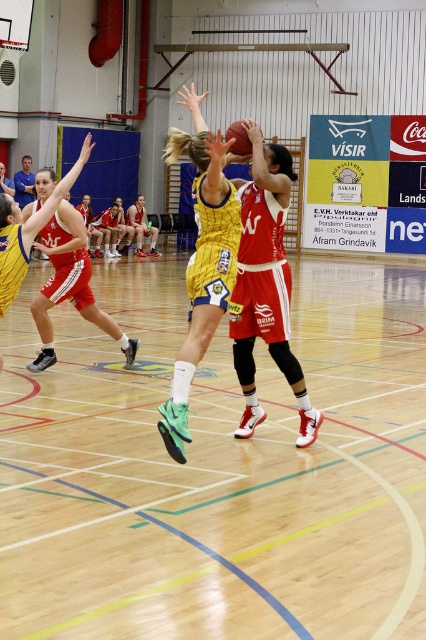
Question: Among these points, which one is nearest to the camera?

Choices:
 (A) (247, 150)
 (B) (137, 236)
 (C) (278, 164)
 (D) (288, 164)

Answer: (A)

Question: Does matte red jersey at center have a smaller size compared to yellow jersey at center?

Choices:
 (A) yes
 (B) no

Answer: (A)

Question: Is wooden at center further to camera compared to blue shirt at upper left?

Choices:
 (A) yes
 (B) no

Answer: (B)

Question: Among these points, which one is farthest from the camera?

Choices:
 (A) (273, 332)
 (B) (31, 180)

Answer: (B)

Question: Which of the following is the farthest from the observer?

Choices:
 (A) (304, 420)
 (B) (176, 280)
 (C) (230, 132)

Answer: (B)

Question: Does matte red jersey at center have a lesser width compared to yellow jersey at center?

Choices:
 (A) no
 (B) yes

Answer: (B)